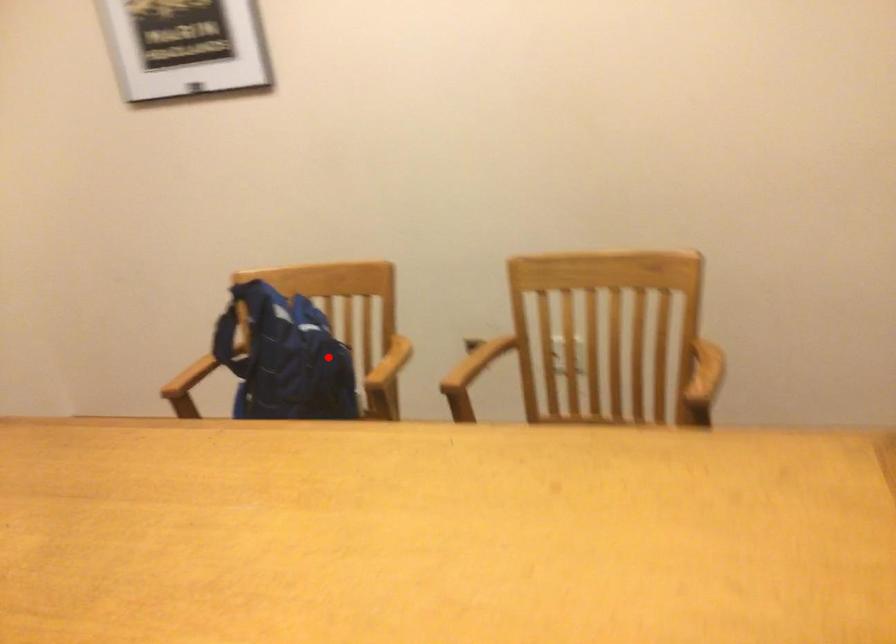
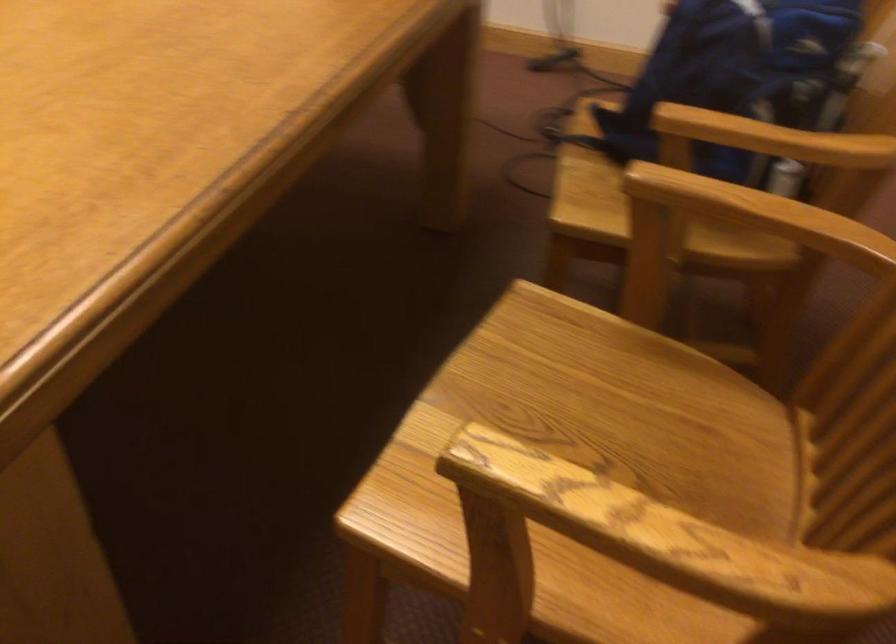
Question: I am providing you with two images of the same scene from different viewpoints. A red point is shown in image1. For the corresponding object point in image2, is it positioned nearer or farther from the camera?

Choices:
 (A) Nearer
 (B) Farther

Answer: (A)